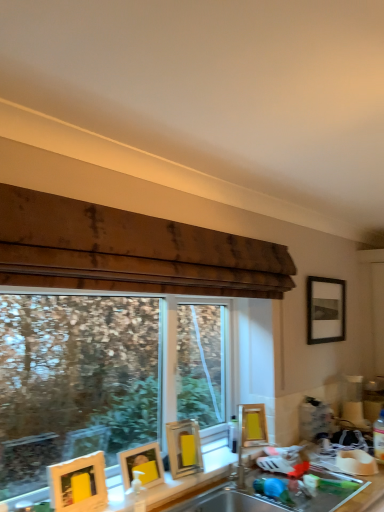
Measure the distance between matte yellow picture frame at lower left, which is counted as the fifth picture frame, starting from the back, and camera.

matte yellow picture frame at lower left, which is counted as the fifth picture frame, starting from the back, is 5.16 feet from camera.

This screenshot has width=384, height=512. What do you see at coordinates (99, 377) in the screenshot? I see `transparent glass window at center` at bounding box center [99, 377].

Find the location of a particular element. transparent glass window at center is located at coordinates (99, 377).

Identify the location of matte gold picture frame at lower left, placed as the second picture frame when sorted from left to right. (142, 465).

Describe the element at coordinates (142, 465) in the screenshot. This screenshot has width=384, height=512. I see `matte gold picture frame at lower left, which is the 4th picture frame in right-to-left order` at that location.

Image resolution: width=384 pixels, height=512 pixels. What do you see at coordinates (269, 496) in the screenshot?
I see `stainless steel sink at lower center, placed as the second sink when sorted from top to bottom` at bounding box center [269, 496].

Locate an element on the screen. This screenshot has height=512, width=384. stainless steel sink at lower center, placed as the 1th sink when sorted from bottom to top is located at coordinates (269, 496).

The width and height of the screenshot is (384, 512). I want to click on matte silver sink at center, marked as the 1th sink in a top-to-bottom arrangement, so click(237, 474).

The image size is (384, 512). Find the location of `matte yellow picture frame at lower left, which ranks as the first picture frame in left-to-right order`. matte yellow picture frame at lower left, which ranks as the first picture frame in left-to-right order is located at coordinates (78, 484).

Which is in front, point (251, 420) or point (222, 483)?

The point (222, 483) is closer.

Is yellow matte picture frame at center, which is the 4th picture frame in front-to-back order, positioned in front of stainless steel sink at lower center, placed as the second sink when sorted from top to bottom?

No, yellow matte picture frame at center, which is the 4th picture frame in front-to-back order, is further to the viewer.

Can you confirm if yellow matte picture frame at center, arranged as the 2th picture frame when viewed from the back, is positioned to the right of stainless steel sink at lower center, placed as the 1th sink when sorted from bottom to top?

Indeed, yellow matte picture frame at center, arranged as the 2th picture frame when viewed from the back, is positioned on the right side of stainless steel sink at lower center, placed as the 1th sink when sorted from bottom to top.

Is yellow matte picture frame at center, placed as the 2th picture frame when sorted from right to left, next to stainless steel sink at lower center, placed as the second sink when sorted from top to bottom?

No.

In the scene shown: Can transparent glass window at center be found inside yellow matte picture frame at center, arranged as the 2th picture frame when viewed from the back?

No, transparent glass window at center is not inside yellow matte picture frame at center, arranged as the 2th picture frame when viewed from the back.

Can you confirm if yellow matte picture frame at center, placed as the 2th picture frame when sorted from right to left, is taller than transparent glass window at center?

No.

Based on their positions, is yellow matte picture frame at center, which appears as the 4th picture frame when viewed from the left, located to the left or right of transparent glass window at center?

In the image, yellow matte picture frame at center, which appears as the 4th picture frame when viewed from the left, appears on the right side of transparent glass window at center.

Between black matte picture frame at upper right, positioned as the 5th picture frame in front-to-back order, and yellow matte picture frame at center, arranged as the 2th picture frame when viewed from the back, which one has less height?

yellow matte picture frame at center, arranged as the 2th picture frame when viewed from the back, is shorter.

How different are the orientations of black matte picture frame at upper right, positioned as the 5th picture frame in front-to-back order, and yellow matte picture frame at center, which is the 4th picture frame in front-to-back order, in degrees?

There is a 30.7-degree angle between the facing directions of black matte picture frame at upper right, positioned as the 5th picture frame in front-to-back order, and yellow matte picture frame at center, which is the 4th picture frame in front-to-back order.

Which object is further away from the camera, black matte picture frame at upper right, which is the fifth picture frame from left to right, or yellow matte picture frame at center, placed as the 2th picture frame when sorted from right to left?

→ black matte picture frame at upper right, which is the fifth picture frame from left to right, is further from the camera.

From the image's perspective, which is below, black matte picture frame at upper right, the 1th picture frame positioned from the right, or yellow matte picture frame at center, which appears as the 4th picture frame when viewed from the left?

yellow matte picture frame at center, which appears as the 4th picture frame when viewed from the left.

Are matte gold picture frame at lower left, positioned as the 2th picture frame in front-to-back order, and matte silver sink at center, marked as the 1th sink in a top-to-bottom arrangement, far apart?

matte gold picture frame at lower left, positioned as the 2th picture frame in front-to-back order, is actually quite close to matte silver sink at center, marked as the 1th sink in a top-to-bottom arrangement.

What's the angular difference between matte gold picture frame at lower left, marked as the fourth picture frame in a back-to-front arrangement, and matte silver sink at center, marked as the 1th sink in a top-to-bottom arrangement,'s facing directions?

The angular difference between matte gold picture frame at lower left, marked as the fourth picture frame in a back-to-front arrangement, and matte silver sink at center, marked as the 1th sink in a top-to-bottom arrangement, is 1.07 degrees.

Considering the relative sizes of matte gold picture frame at lower left, which is the 4th picture frame in right-to-left order, and matte silver sink at center, which is the second sink in bottom-to-top order, in the image provided, is matte gold picture frame at lower left, which is the 4th picture frame in right-to-left order, smaller than matte silver sink at center, which is the second sink in bottom-to-top order,?

Yes.

Is point (125, 484) closer to viewer compared to point (249, 464)?

Yes, point (125, 484) is in front of point (249, 464).

From the image's perspective, which is above, transparent glass window at center or stainless steel sink at lower center, placed as the 1th sink when sorted from bottom to top?

transparent glass window at center, from the image's perspective.

Does point (199, 341) come farther from viewer compared to point (347, 494)?

Yes, it is behind point (347, 494).

Based on the photo, is transparent glass window at center turned away from stainless steel sink at lower center, placed as the second sink when sorted from top to bottom?

No, transparent glass window at center is not facing the opposite direction of stainless steel sink at lower center, placed as the second sink when sorted from top to bottom.

Between transparent glass window at center and yellow matte picture frame at center, arranged as the 2th picture frame when viewed from the back, which one has smaller width?

Thinner between the two is transparent glass window at center.

Could you measure the distance between transparent glass window at center and yellow matte picture frame at center, arranged as the 2th picture frame when viewed from the back?

The distance of transparent glass window at center from yellow matte picture frame at center, arranged as the 2th picture frame when viewed from the back, is 2.11 meters.

Which is in front, point (5, 312) or point (253, 425)?

The point (253, 425) is in front.

Looking at this image, is transparent glass window at center to the right of yellow matte picture frame at center, which appears as the 4th picture frame when viewed from the left, from the viewer's perspective?

No, transparent glass window at center is not to the right of yellow matte picture frame at center, which appears as the 4th picture frame when viewed from the left.

From the stainless steel sink at lower center, placed as the 1th sink when sorted from bottom to top, count the 2nd picture frame to the left and point to it. Please provide its 2D coordinates.

[(142, 465)]

Is point (234, 501) closer or farther from the camera than point (153, 469)?

Clearly, point (234, 501) is more distant from the camera than point (153, 469).

Looking at their sizes, would you say stainless steel sink at lower center, placed as the second sink when sorted from top to bottom, is wider or thinner than matte gold picture frame at lower left, marked as the fourth picture frame in a back-to-front arrangement?

stainless steel sink at lower center, placed as the second sink when sorted from top to bottom, is wider than matte gold picture frame at lower left, marked as the fourth picture frame in a back-to-front arrangement.

Consider the image. Is stainless steel sink at lower center, placed as the 1th sink when sorted from bottom to top, far from matte gold picture frame at lower left, positioned as the 2th picture frame in front-to-back order?

stainless steel sink at lower center, placed as the 1th sink when sorted from bottom to top, is actually quite close to matte gold picture frame at lower left, positioned as the 2th picture frame in front-to-back order.

Where is `sink lying below the yellow matte picture frame at center, which appears as the 4th picture frame when viewed from the left (from the image's perspective)`? This screenshot has width=384, height=512. sink lying below the yellow matte picture frame at center, which appears as the 4th picture frame when viewed from the left (from the image's perspective) is located at coordinates (269, 496).

Locate an element on the screen. The image size is (384, 512). window located in front of the yellow matte picture frame at center, arranged as the 2th picture frame when viewed from the back is located at coordinates (99, 377).

Which object lies nearer to the anchor point black matte picture frame at upper right, which ranks as the first picture frame in back-to-front order, matte gold picture frame at lower left, which is the 4th picture frame in right-to-left order, or matte silver sink at center, which is the second sink in bottom-to-top order?

matte silver sink at center, which is the second sink in bottom-to-top order, lies closer to black matte picture frame at upper right, which ranks as the first picture frame in back-to-front order, than the other object.

Which object lies further to the anchor point black matte picture frame at upper right, which is the fifth picture frame from left to right, matte yellow picture frame at lower left, the 1th picture frame positioned from the front, or matte silver sink at center, marked as the 1th sink in a top-to-bottom arrangement?

The object further to black matte picture frame at upper right, which is the fifth picture frame from left to right, is matte yellow picture frame at lower left, the 1th picture frame positioned from the front.

When comparing their distances from yellow matte picture frame at center, which appears as the 4th picture frame when viewed from the left, does transparent glass window at center or yellow matte picture frame at lower center, the third picture frame viewed from the left, seem further?

The object further to yellow matte picture frame at center, which appears as the 4th picture frame when viewed from the left, is transparent glass window at center.

Looking at the image, which one is located further to yellow matte picture frame at lower center, the third picture frame viewed from the left, black matte picture frame at upper right, positioned as the 5th picture frame in front-to-back order, or matte yellow picture frame at lower left, which ranks as the first picture frame in left-to-right order?

black matte picture frame at upper right, positioned as the 5th picture frame in front-to-back order, is further to yellow matte picture frame at lower center, the third picture frame viewed from the left.

Looking at the image, which one is located further to yellow matte picture frame at center, arranged as the 2th picture frame when viewed from the back, yellow matte picture frame at lower center, which is counted as the 3th picture frame, starting from the back, or matte gold picture frame at lower left, which is the 4th picture frame in right-to-left order?

The object further to yellow matte picture frame at center, arranged as the 2th picture frame when viewed from the back, is matte gold picture frame at lower left, which is the 4th picture frame in right-to-left order.

Looking at this image, based on their spatial positions, is matte yellow picture frame at lower left, the 1th picture frame positioned from the front, or transparent glass window at center closer to yellow matte picture frame at center, placed as the 2th picture frame when sorted from right to left?

matte yellow picture frame at lower left, the 1th picture frame positioned from the front, lies closer to yellow matte picture frame at center, placed as the 2th picture frame when sorted from right to left, than the other object.

From the image, which object appears to be farther from transparent glass window at center, black matte picture frame at upper right, which is the fifth picture frame from left to right, or matte yellow picture frame at lower left, the 1th picture frame positioned from the front?

matte yellow picture frame at lower left, the 1th picture frame positioned from the front, is positioned further to the anchor transparent glass window at center.

Based on their spatial positions, is matte yellow picture frame at lower left, the 1th picture frame positioned from the front, or stainless steel sink at lower center, placed as the second sink when sorted from top to bottom, further from matte gold picture frame at lower left, placed as the second picture frame when sorted from left to right?

stainless steel sink at lower center, placed as the second sink when sorted from top to bottom.

Where is `sink between matte yellow picture frame at lower left, which ranks as the first picture frame in left-to-right order, and stainless steel sink at lower center, placed as the 1th sink when sorted from bottom to top, in the horizontal direction`? sink between matte yellow picture frame at lower left, which ranks as the first picture frame in left-to-right order, and stainless steel sink at lower center, placed as the 1th sink when sorted from bottom to top, in the horizontal direction is located at coordinates (237, 474).

The height and width of the screenshot is (512, 384). What are the coordinates of `window between matte yellow picture frame at lower left, marked as the 5th picture frame in a right-to-left arrangement, and matte silver sink at center, which is the second sink in bottom-to-top order, in the horizontal direction` in the screenshot? It's located at (99, 377).

At what (x,y) coordinates should I click in order to perform the action: click on picture frame located between transparent glass window at center and yellow matte picture frame at lower center, which is the 3th picture frame from right to left, in the depth direction. Please return your answer as a coordinate pair (x, y). Looking at the image, I should click on [x=142, y=465].

In order to click on picture frame located between matte gold picture frame at lower left, positioned as the 2th picture frame in front-to-back order, and yellow matte picture frame at center, which appears as the 4th picture frame when viewed from the left, in the depth direction in this screenshot , I will do `click(184, 447)`.